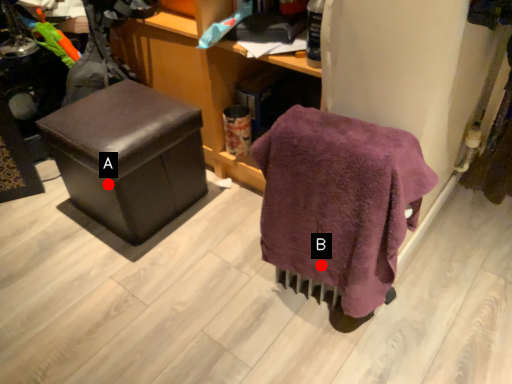
Question: Two points are circled on the image, labeled by A and B beside each circle. Which point appears farthest from the camera in this image?

Choices:
 (A) A is further
 (B) B is further

Answer: (A)